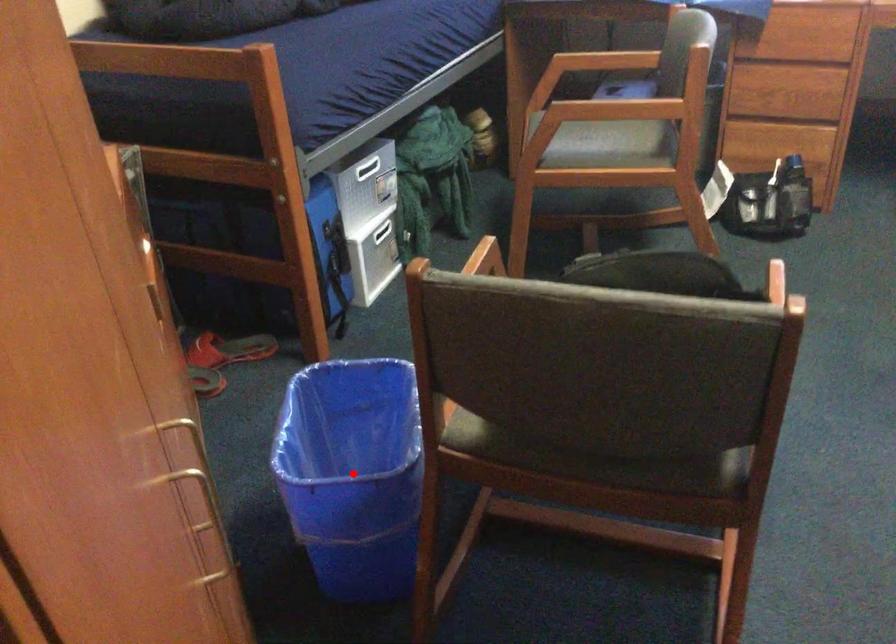
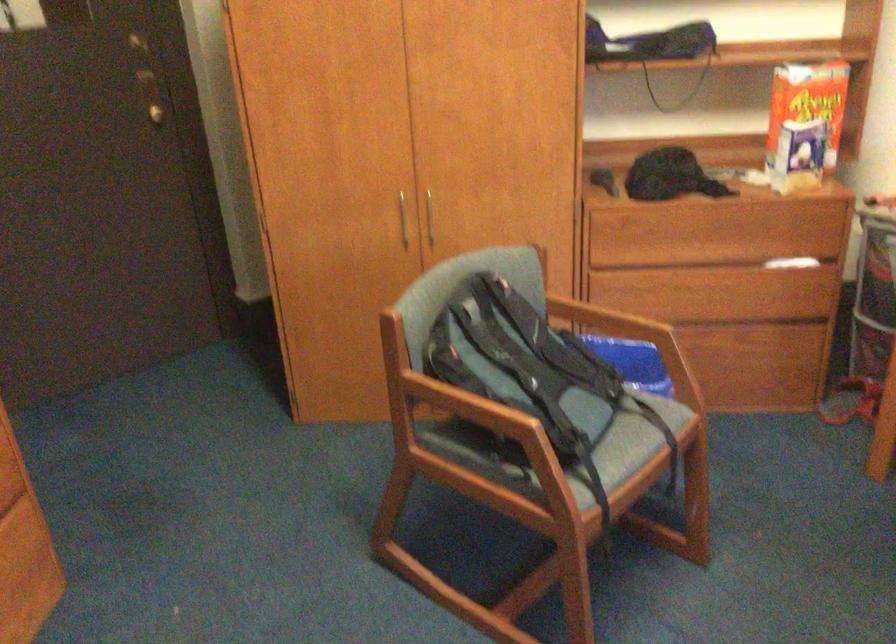
Question: I am providing you with two images of the same scene from different viewpoints. A red point is marked on the first image. At the location where the point appears in image 1, is it still visible in image 2?

Choices:
 (A) Yes
 (B) No

Answer: (B)